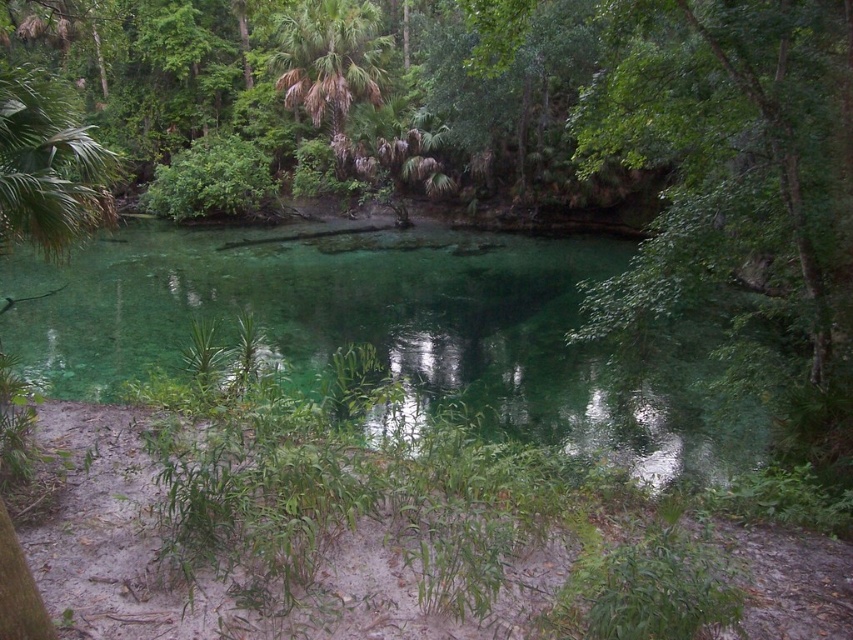
You are a photographer planning to capture the reflection of the green leafy palm tree at upper center in the clear glassy water at center. Considering their sizes, will the palm tree fit entirely within the water area in your photo?

The clear glassy water at center has a larger size compared to green leafy palm tree at upper center, so yes, the palm tree will fit entirely within the water area in your photo since the water area is bigger than the tree.

You are standing on the sand and see the clear glassy water at center and the green leafy tree at center. Which object is taller?

The green leafy tree at center is taller than the clear glassy water at center.